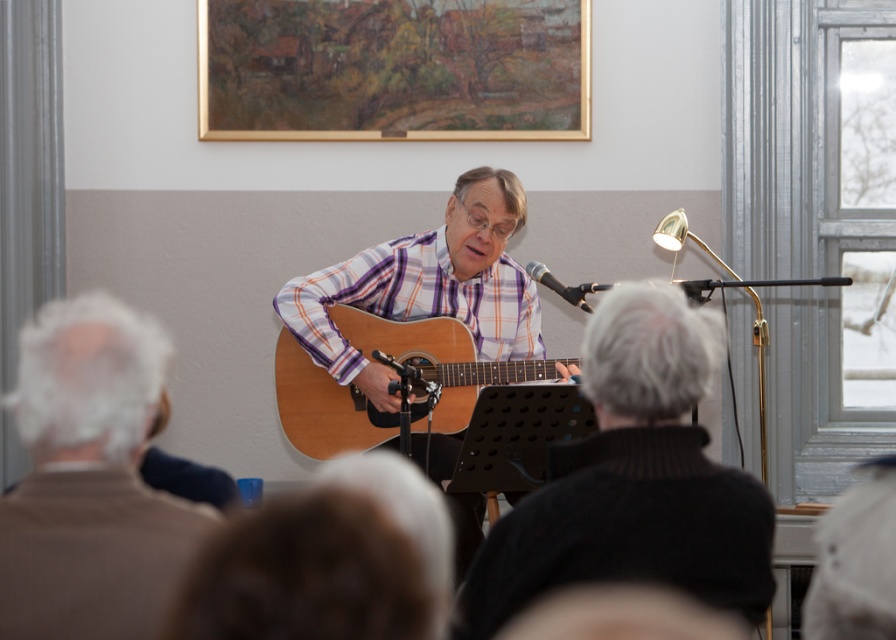
Question: Which of the following is the closest to the observer?

Choices:
 (A) brown wool sweater at left
 (B) wooden acoustic guitar at center
 (C) natural wood acoustic guitar at center
 (D) metallic silver microphone at center

Answer: (A)

Question: Does brown wool sweater at left appear under wooden acoustic guitar at center?

Choices:
 (A) yes
 (B) no

Answer: (A)

Question: Observing the image, what is the correct spatial positioning of gold-framed painting at upper center in reference to metallic silver microphone at center?

Choices:
 (A) below
 (B) above

Answer: (B)

Question: Which point is farther to the camera?

Choices:
 (A) (424, 128)
 (B) (300, 333)
 (C) (42, 552)

Answer: (A)

Question: Can you confirm if acoustic guitar at center is thinner than metallic silver microphone at center?

Choices:
 (A) yes
 (B) no

Answer: (B)

Question: Among these points, which one is nearest to the camera?

Choices:
 (A) (765, 493)
 (B) (573, 298)

Answer: (A)